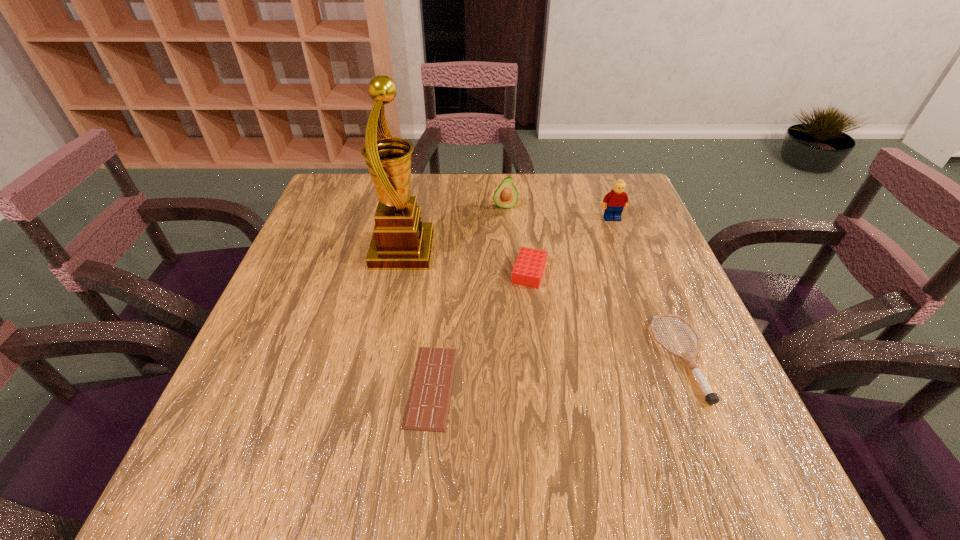
This screenshot has width=960, height=540. What are the coordinates of `the tallest object` in the screenshot? It's located at point(401,241).

At what (x,y) coordinates should I click in order to perform the action: click on the second farthest object. Please return your answer as a coordinate pair (x, y). This screenshot has width=960, height=540. Looking at the image, I should click on (617, 199).

In order to click on the farther Lego in this screenshot , I will do `click(617, 199)`.

This screenshot has height=540, width=960. I want to click on the fourth shortest object, so click(x=506, y=196).

This screenshot has height=540, width=960. I want to click on the farthest object, so click(x=506, y=196).

The width and height of the screenshot is (960, 540). Identify the location of the nearer Lego. (528, 270).

Identify the location of the left Lego. (528, 270).

Locate an element on the screen. the fifth tallest object is located at coordinates (711, 398).

Find the location of a particular element. The height and width of the screenshot is (540, 960). the shortest object is located at coordinates (427, 409).

You are a GUI agent. You are given a task and a screenshot of the screen. Output one action in this format:
    pyautogui.click(x=<x>, y=<y>)
    Task: Click on the free space located on the front-facing side of the award
    The height and width of the screenshot is (540, 960).
    Given the screenshot: What is the action you would take?
    pyautogui.click(x=590, y=251)